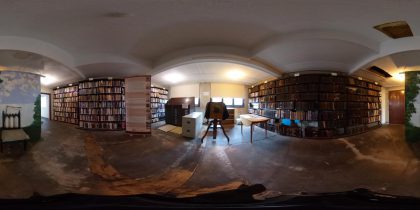
You are a GUI agent. You are given a task and a screenshot of the screen. Output one action in this format:
    pyautogui.click(x=<x>, y=<y>)
    Task: Click on the bookshelves
    
    Given the screenshot: What is the action you would take?
    pyautogui.click(x=64, y=102), pyautogui.click(x=101, y=104), pyautogui.click(x=159, y=100), pyautogui.click(x=256, y=98), pyautogui.click(x=278, y=96), pyautogui.click(x=359, y=102), pyautogui.click(x=377, y=103), pyautogui.click(x=309, y=103)